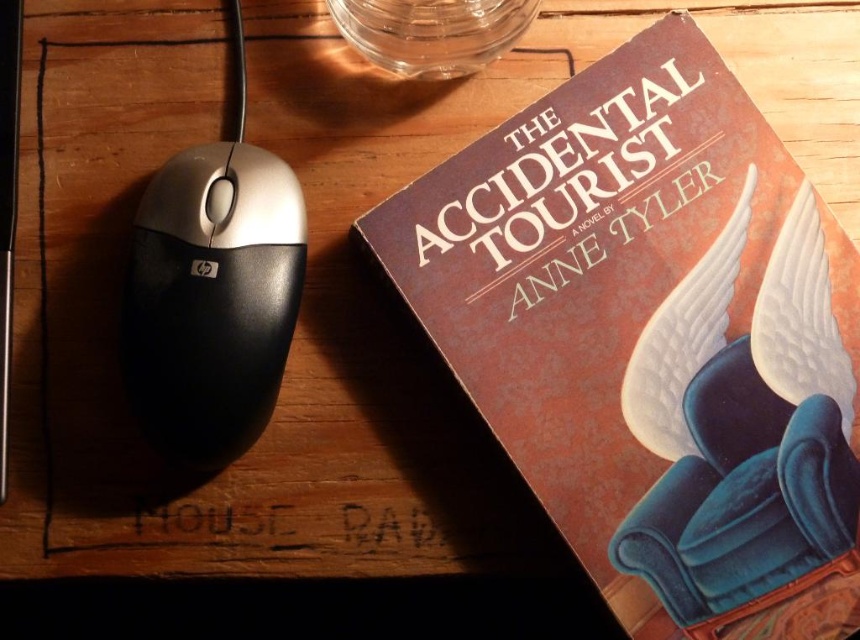
Question: Which of these objects is positioned closest to the blue velvet armchair at upper right?

Choices:
 (A) transparent glass bowl at upper center
 (B) matte brown paper at upper right

Answer: (B)

Question: Which point is farther from the camera taking this photo?

Choices:
 (A) (268, 360)
 (B) (602, 410)

Answer: (B)

Question: Where is blue velvet armchair at upper right located in relation to transparent glass bowl at upper center in the image?

Choices:
 (A) below
 (B) above

Answer: (A)

Question: Is black plastic mouse at left behind transparent glass bowl at upper center?

Choices:
 (A) no
 (B) yes

Answer: (A)

Question: Does matte brown paper at upper right have a larger size compared to transparent glass bowl at upper center?

Choices:
 (A) no
 (B) yes

Answer: (B)

Question: Which point is closer to the camera?

Choices:
 (A) matte brown paper at upper right
 (B) black plastic mouse at left
 (C) transparent glass bowl at upper center
 (D) blue velvet armchair at upper right

Answer: (B)